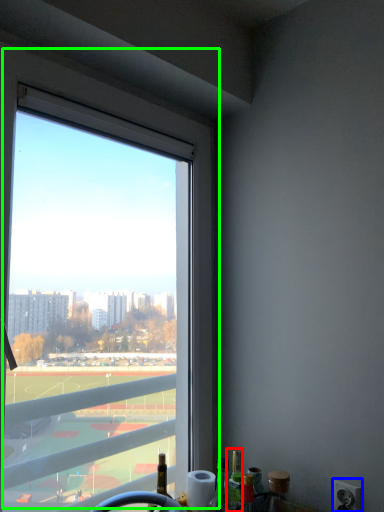
Question: Based on their relative distances, which object is nearer to bottle (highlighted by a red box)? Choose from power outlet (highlighted by a blue box) and window (highlighted by a green box).

Choices:
 (A) power outlet
 (B) window

Answer: (A)